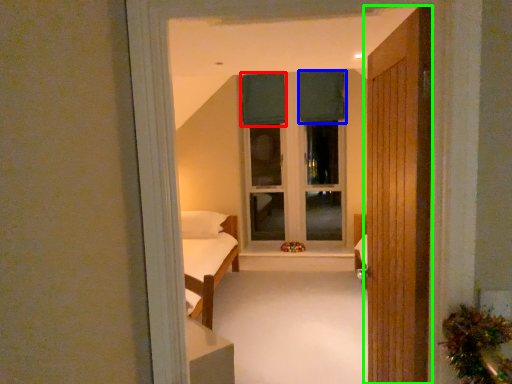
Question: Which is farther away from curtain (highlighted by a red box)? curtain (highlighted by a blue box) or door (highlighted by a green box)?

Choices:
 (A) curtain
 (B) door

Answer: (B)